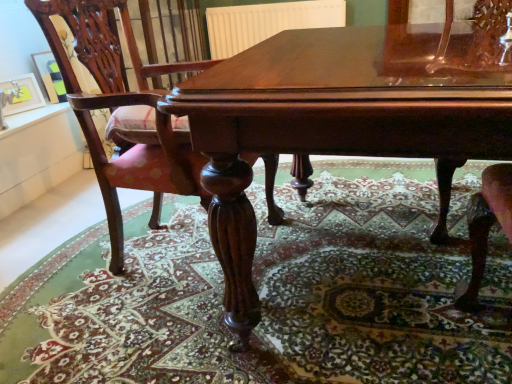
Question: From the image's perspective, is white matte radiator at upper center above or below matte black picture frame at upper left, which is the 2th picture frame from front to back?

Choices:
 (A) above
 (B) below

Answer: (A)

Question: In the image, is white matte radiator at upper center positioned in front of or behind matte black picture frame at upper left, which appears as the first picture frame when viewed from the back?

Choices:
 (A) behind
 (B) front

Answer: (A)

Question: Based on their relative distances, which object is nearer to the white matte radiator at upper center?

Choices:
 (A) polished wood chair at center
 (B) polished wood table at center
 (C) carpeted floor at center
 (D) matte black picture frame at upper left, which is the 2th picture frame from front to back
 (E) brushed metal picture frame at upper left, arranged as the second picture frame when viewed from the back

Answer: (D)

Question: Considering the real-world distances, which object is closest to the white matte radiator at upper center?

Choices:
 (A) brushed metal picture frame at upper left, arranged as the second picture frame when viewed from the back
 (B) carpeted floor at center
 (C) polished wood chair at center
 (D) polished wood table at center
 (E) matte black picture frame at upper left, which appears as the first picture frame when viewed from the back

Answer: (E)